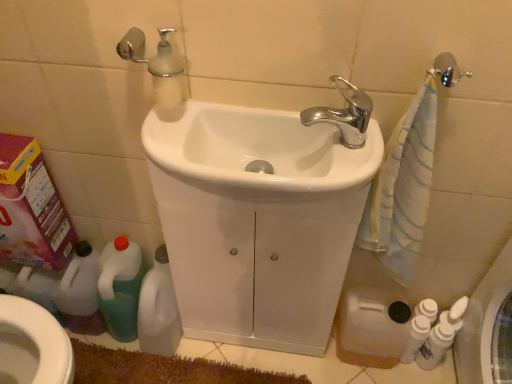
The width and height of the screenshot is (512, 384). I want to click on vacant area that lies between white glossy sink at center, arranged as the 2th sink when viewed from the front, and white plastic bottle at lower left, positioned as the third cleaning product in right-to-left order, so click(x=224, y=352).